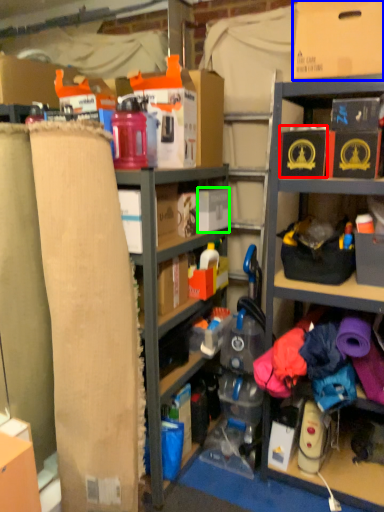
Question: Which is farther away from storage box (highlighted by a red box)? cardboard box (highlighted by a blue box) or storage box (highlighted by a green box)?

Choices:
 (A) cardboard box
 (B) storage box

Answer: (B)